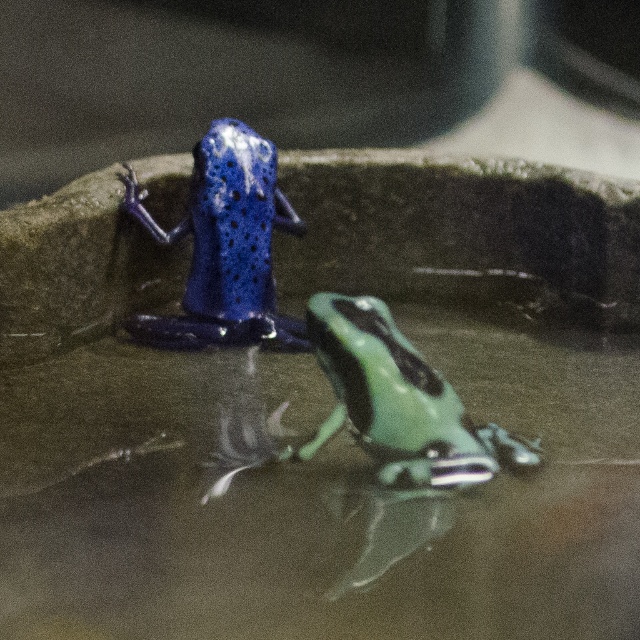
You are a small insect observing the two frogs in the image. Which frog is closer to you, the shiny blue dart frog at upper left or the green matte tree frog at center?

The shiny blue dart frog at upper left is closer to you because it is positioned over the green matte tree frog at center, indicating it is in a higher plane.

You are standing at a point 4.58 feet away from the point at coordinates (304, 230). If you want to reach the blue frog and the green frog, which frog is closer to you?

The blue frog is closer to you because it is positioned above the green frog on the curved surface, and the point you are measuring from is closer to the upper part of the surface where the blue frog is located.

You are a photographer standing in front of the frogs. You want to take a photo that includes both the blue frog and the green frog. Which frog is closer to you, the one at point (x=232, y=182) or the one at point (x=380, y=420)?

The frog at point (x=232, y=182) is closer to you because point (x=232, y=182) is further to the viewer than point (x=380, y=420).